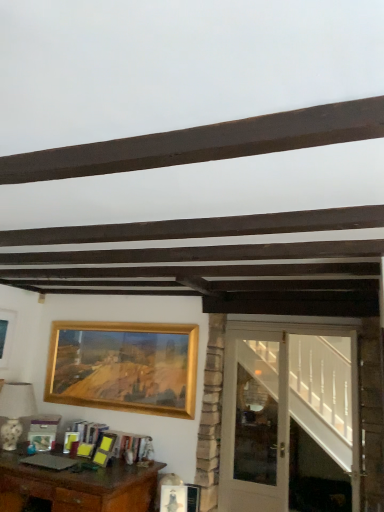
At what (x,y) coordinates should I click in order to perform the action: click on empty space that is ontop of white glossy door at right. Please return your answer as a coordinate pair (x, y). This screenshot has height=512, width=384. Looking at the image, I should click on (294, 323).